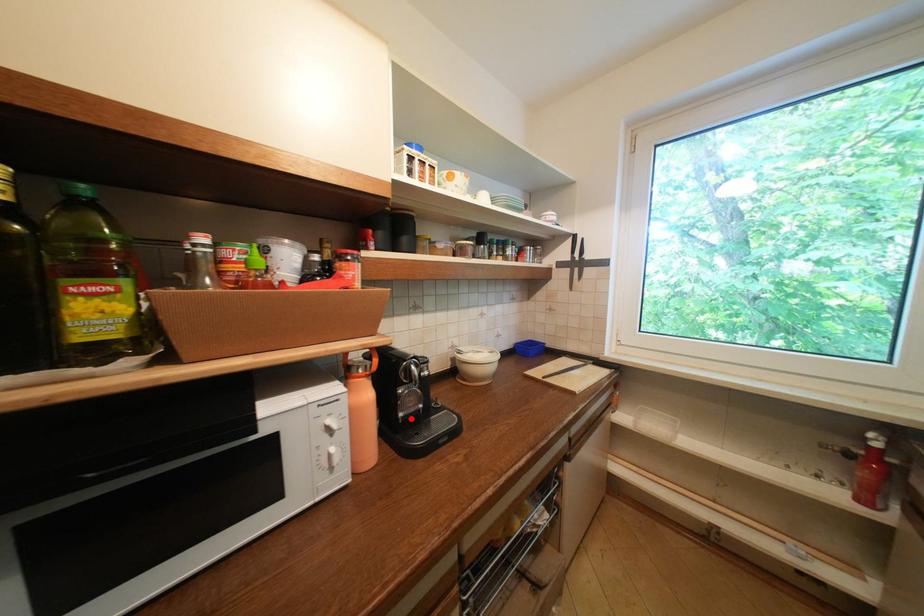
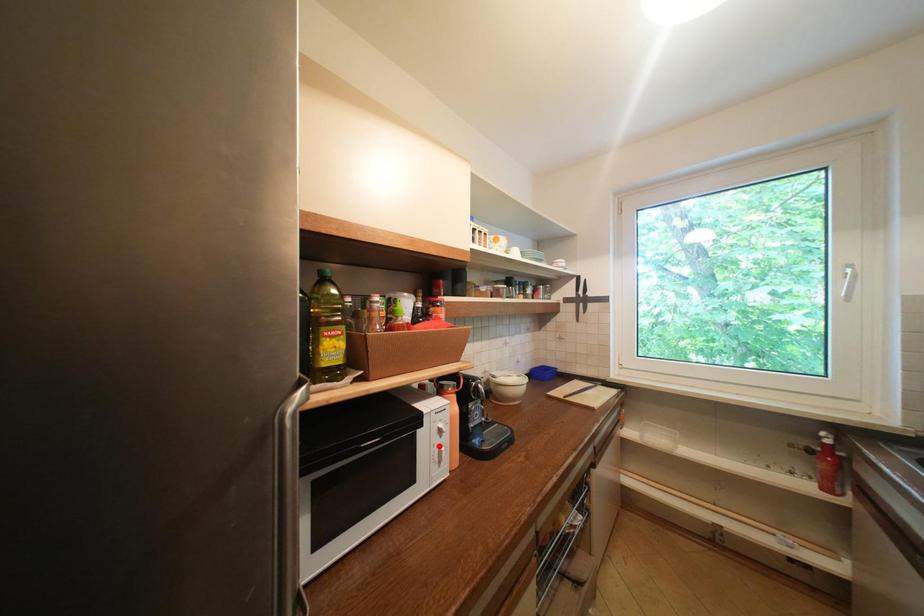
I am providing you with two images of the same scene from different viewpoints. A red point is marked on the first image and another point is marked on the second image. Is the marked point in image1 the same physical position as the marked point in image2?

No